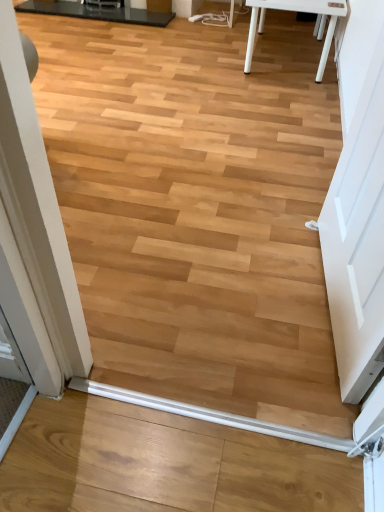
Question: Can you confirm if black glossy table at upper left is positioned to the left of white plastic beam at lower center?

Choices:
 (A) no
 (B) yes

Answer: (B)

Question: Could you tell me if black glossy table at upper left is facing white plastic beam at lower center?

Choices:
 (A) no
 (B) yes

Answer: (B)

Question: Can you confirm if black glossy table at upper left is bigger than white plastic beam at lower center?

Choices:
 (A) no
 (B) yes

Answer: (B)

Question: Is black glossy table at upper left positioned with its back to white plastic beam at lower center?

Choices:
 (A) yes
 (B) no

Answer: (B)

Question: Considering the relative sizes of black glossy table at upper left and white plastic beam at lower center in the image provided, is black glossy table at upper left wider than white plastic beam at lower center?

Choices:
 (A) yes
 (B) no

Answer: (A)

Question: Is black glossy table at upper left outside of white plastic beam at lower center?

Choices:
 (A) no
 (B) yes

Answer: (B)

Question: From a real-world perspective, does white plastic beam at lower center stand above black glossy table at upper left?

Choices:
 (A) no
 (B) yes

Answer: (A)

Question: Is white plastic beam at lower center facing towards black glossy table at upper left?

Choices:
 (A) yes
 (B) no

Answer: (B)

Question: From the image's perspective, would you say white plastic beam at lower center is positioned over black glossy table at upper left?

Choices:
 (A) no
 (B) yes

Answer: (A)

Question: Can you confirm if white plastic beam at lower center is shorter than black glossy table at upper left?

Choices:
 (A) no
 (B) yes

Answer: (B)

Question: Is white plastic beam at lower center looking in the opposite direction of black glossy table at upper left?

Choices:
 (A) yes
 (B) no

Answer: (A)

Question: Can you confirm if white plastic beam at lower center is thinner than black glossy table at upper left?

Choices:
 (A) yes
 (B) no

Answer: (A)

Question: Is white matte door at right oriented towards white plastic beam at lower center?

Choices:
 (A) no
 (B) yes

Answer: (B)